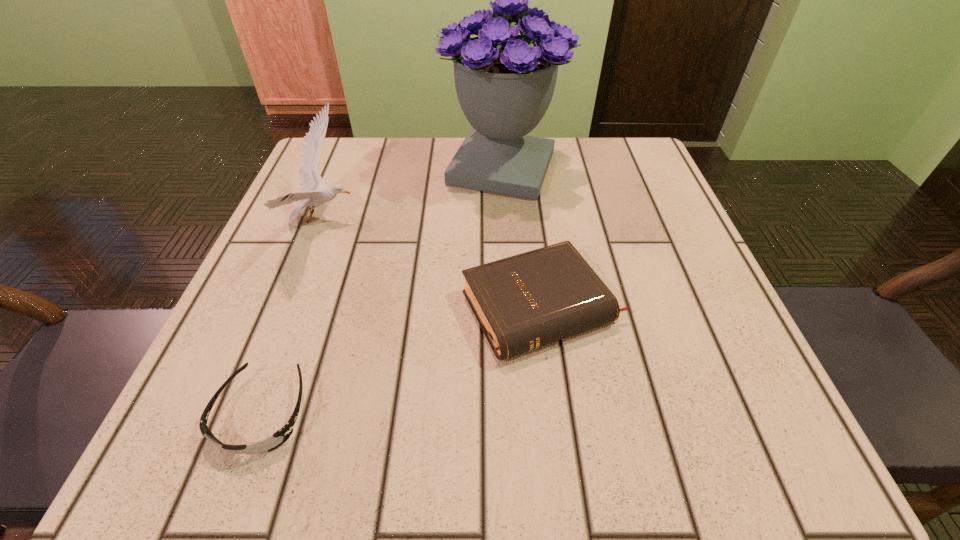
The width and height of the screenshot is (960, 540). Find the location of `object located at the near edge`. object located at the near edge is located at coordinates [x=279, y=437].

Identify the location of gull located in the left edge section of the desktop. (315, 192).

I want to click on sunglasses at the left edge, so click(x=279, y=437).

This screenshot has height=540, width=960. What are the coordinates of `object situated at the right edge` in the screenshot? It's located at (526, 301).

Find the location of `object that is at the far left corner`. object that is at the far left corner is located at coordinates (315, 192).

At what (x,y) coordinates should I click in order to perform the action: click on object that is positioned at the near left corner. Please return your answer as a coordinate pair (x, y). This screenshot has width=960, height=540. Looking at the image, I should click on (279, 437).

The height and width of the screenshot is (540, 960). I want to click on free space at the far edge, so click(444, 147).

The height and width of the screenshot is (540, 960). I want to click on vacant space at the near edge of the desktop, so click(x=540, y=442).

Image resolution: width=960 pixels, height=540 pixels. I want to click on vacant space at the left edge of the desktop, so point(344,262).

Image resolution: width=960 pixels, height=540 pixels. Identify the location of free space at the right edge of the desktop. (704, 369).